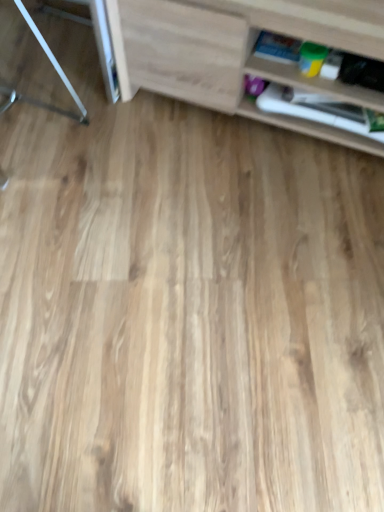
Question: Are metallic silver table at left and wooden shelf at right, the 1th shelf when ordered from back to front, far apart?

Choices:
 (A) yes
 (B) no

Answer: (B)

Question: Can you confirm if metallic silver table at left is bigger than wooden shelf at right, the 1th shelf when ordered from back to front?

Choices:
 (A) yes
 (B) no

Answer: (A)

Question: Is metallic silver table at left closer to camera compared to wooden shelf at right, the 1th shelf when ordered from back to front?

Choices:
 (A) no
 (B) yes

Answer: (B)

Question: Is metallic silver table at left facing away from wooden shelf at right, marked as the second shelf in a front-to-back arrangement?

Choices:
 (A) yes
 (B) no

Answer: (A)

Question: Is metallic silver table at left in contact with wooden shelf at right, the 1th shelf when ordered from back to front?

Choices:
 (A) yes
 (B) no

Answer: (B)

Question: Considering their positions, is light wood cabinet at upper right, placed as the 1th shelf when sorted from front to back, located in front of or behind wooden shelf at right, marked as the second shelf in a front-to-back arrangement?

Choices:
 (A) behind
 (B) front

Answer: (B)

Question: From the image's perspective, is light wood cabinet at upper right, which appears as the second shelf when viewed from the back, located above or below wooden shelf at right, marked as the second shelf in a front-to-back arrangement?

Choices:
 (A) above
 (B) below

Answer: (A)

Question: In terms of width, does light wood cabinet at upper right, placed as the 1th shelf when sorted from front to back, look wider or thinner when compared to wooden shelf at right, the 1th shelf when ordered from back to front?

Choices:
 (A) thin
 (B) wide

Answer: (B)

Question: Based on their positions, is light wood cabinet at upper right, which appears as the second shelf when viewed from the back, located to the left or right of wooden shelf at right, the 1th shelf when ordered from back to front?

Choices:
 (A) right
 (B) left

Answer: (B)

Question: Considering the positions of wooden shelf at right, the 1th shelf when ordered from back to front, and light wood cabinet at upper right, placed as the 1th shelf when sorted from front to back, in the image, is wooden shelf at right, the 1th shelf when ordered from back to front, wider or thinner than light wood cabinet at upper right, placed as the 1th shelf when sorted from front to back,?

Choices:
 (A) wide
 (B) thin

Answer: (B)

Question: Visually, is wooden shelf at right, marked as the second shelf in a front-to-back arrangement, positioned to the left or to the right of light wood cabinet at upper right, placed as the 1th shelf when sorted from front to back?

Choices:
 (A) left
 (B) right

Answer: (B)

Question: Is wooden shelf at right, the 1th shelf when ordered from back to front, bigger or smaller than light wood cabinet at upper right, which appears as the second shelf when viewed from the back?

Choices:
 (A) big
 (B) small

Answer: (B)

Question: Considering the positions of wooden shelf at right, marked as the second shelf in a front-to-back arrangement, and light wood cabinet at upper right, placed as the 1th shelf when sorted from front to back, in the image, is wooden shelf at right, marked as the second shelf in a front-to-back arrangement, taller or shorter than light wood cabinet at upper right, placed as the 1th shelf when sorted from front to back,?

Choices:
 (A) short
 (B) tall

Answer: (A)

Question: Considering the positions of metallic silver table at left and wooden shelf at right, marked as the second shelf in a front-to-back arrangement, in the image, is metallic silver table at left taller or shorter than wooden shelf at right, marked as the second shelf in a front-to-back arrangement,?

Choices:
 (A) tall
 (B) short

Answer: (A)

Question: From the image's perspective, relative to wooden shelf at right, the 1th shelf when ordered from back to front, is metallic silver table at left above or below?

Choices:
 (A) below
 (B) above

Answer: (B)